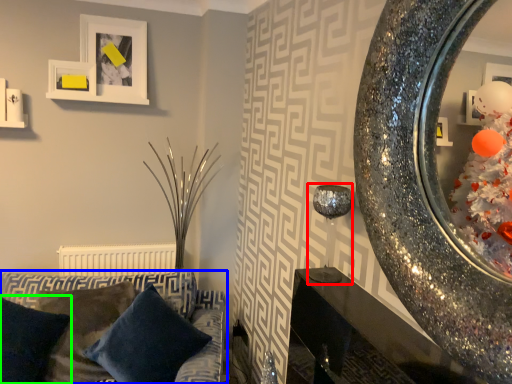
Question: Which is nearer to the candle holder (highlighted by a red box)? studio couch (highlighted by a blue box) or pillow (highlighted by a green box).

Choices:
 (A) studio couch
 (B) pillow

Answer: (A)